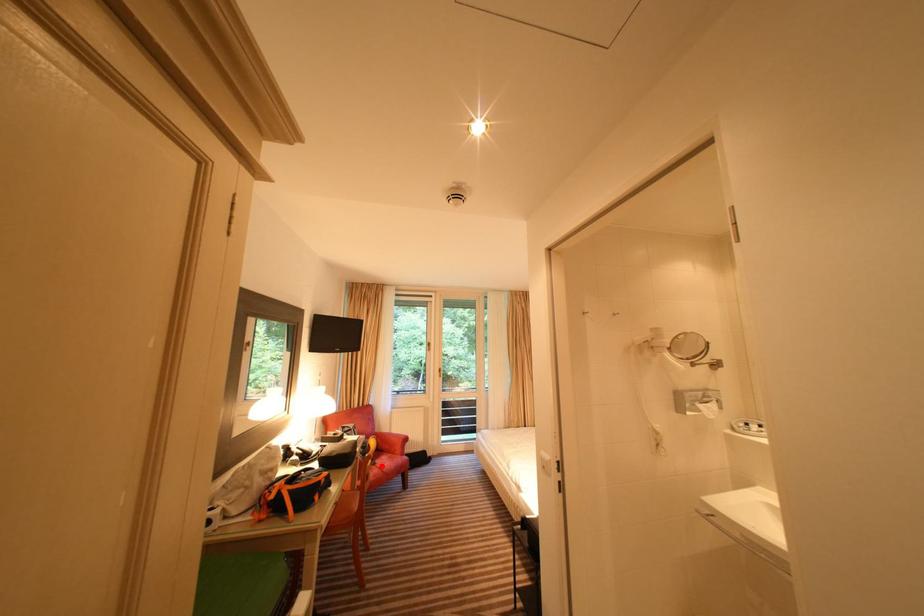
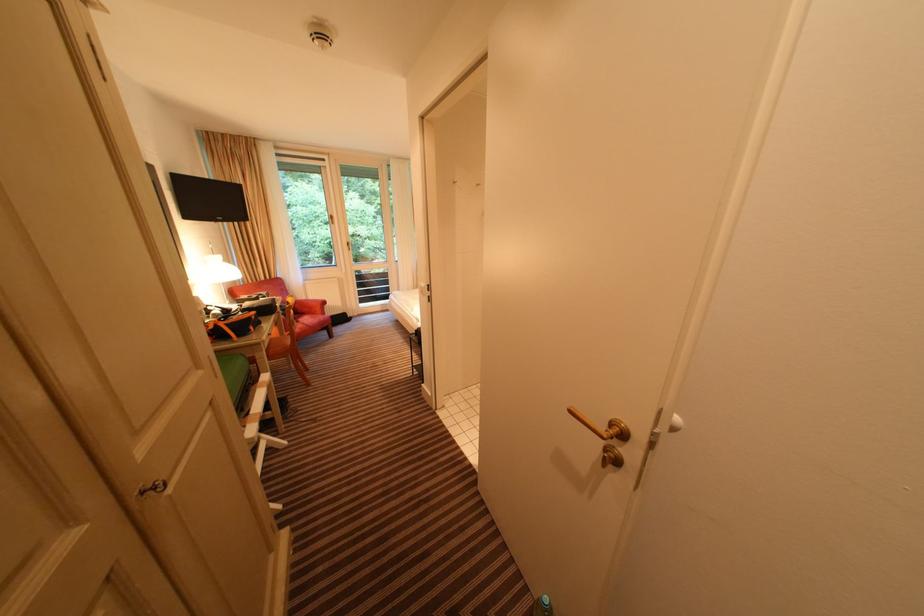
Locate, in the second image, the point that corresponds to the highlighted location in the first image.

(305, 323)